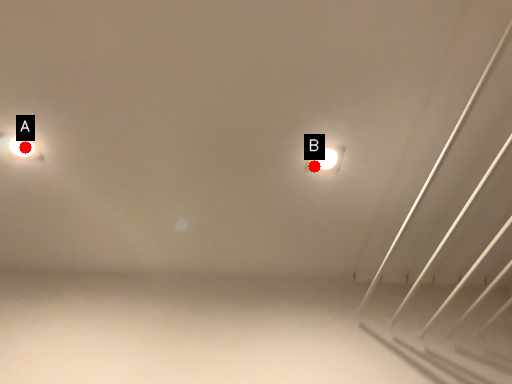
Question: Two points are circled on the image, labeled by A and B beside each circle. Which point is closer to the camera?

Choices:
 (A) A is closer
 (B) B is closer

Answer: (A)